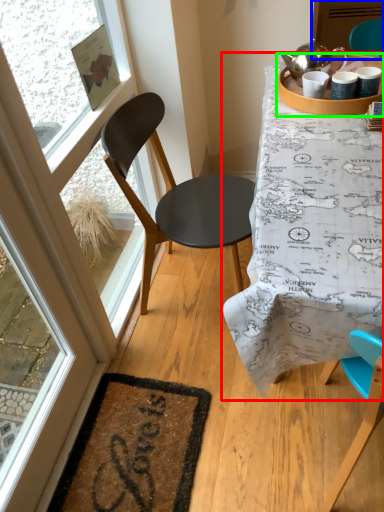
Question: Considering the real-world distances, which object is closest to table (highlighted by a red box)? screen door (highlighted by a blue box) or round table (highlighted by a green box).

Choices:
 (A) screen door
 (B) round table

Answer: (B)